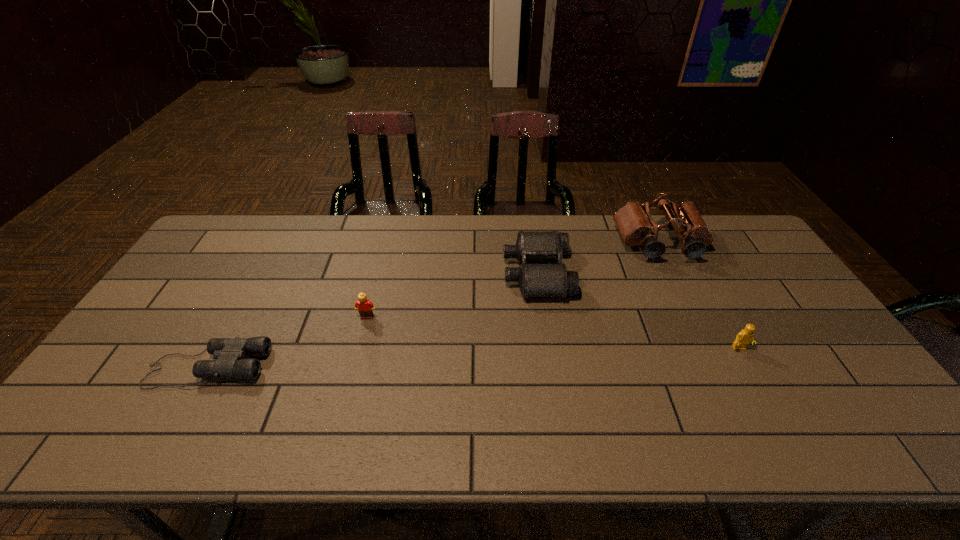
You are a GUI agent. You are given a task and a screenshot of the screen. Output one action in this format:
    pyautogui.click(x=<x>, y=<y>)
    Task: Click on the free spot between the second tallest binoculars and the tallest object
    The width and height of the screenshot is (960, 540).
    Given the screenshot: What is the action you would take?
    pyautogui.click(x=598, y=258)

Where is `vacant area that lies between the right Lego and the farther Lego`? The height and width of the screenshot is (540, 960). vacant area that lies between the right Lego and the farther Lego is located at coordinates (553, 333).

Choose which object is the second nearest neighbor to the nearer Lego. Please provide its 2D coordinates. Your answer should be formatted as a tuple, i.e. [(x, y)], where the tuple contains the x and y coordinates of a point satisfying the conditions above.

[(535, 280)]

Identify which object is located as the fourth nearest to the second tallest binoculars. Please provide its 2D coordinates. Your answer should be formatted as a tuple, i.e. [(x, y)], where the tuple contains the x and y coordinates of a point satisfying the conditions above.

[(229, 353)]

Identify which binoculars is the closest to the third object from left to right. Please provide its 2D coordinates. Your answer should be formatted as a tuple, i.e. [(x, y)], where the tuple contains the x and y coordinates of a point satisfying the conditions above.

[(633, 220)]

At what (x,y) coordinates should I click in order to perform the action: click on binoculars that is the closest one to the tallest object. Please return your answer as a coordinate pair (x, y). The width and height of the screenshot is (960, 540). Looking at the image, I should click on (535, 280).

Locate an element on the screen. This screenshot has height=540, width=960. vacant space that satisfies the following two spatial constraints: 1. through the eyepieces of the rightmost binoculars; 2. through the eyepieces of the third object from right to left is located at coordinates (674, 273).

Image resolution: width=960 pixels, height=540 pixels. I want to click on vacant position in the image that satisfies the following two spatial constraints: 1. through the eyepieces of the third object from left to right; 2. on the face of the fourth object from right to left, so click(543, 318).

Locate an element on the screen. This screenshot has height=540, width=960. vacant area that satisfies the following two spatial constraints: 1. through the eyepieces of the tallest binoculars; 2. at the eyepiece of the shortest binoculars is located at coordinates (720, 367).

The image size is (960, 540). In order to click on free space that satisfies the following two spatial constraints: 1. through the eyepieces of the tallest object; 2. through the eyepieces of the second binoculars from left to right in this screenshot , I will do `click(674, 273)`.